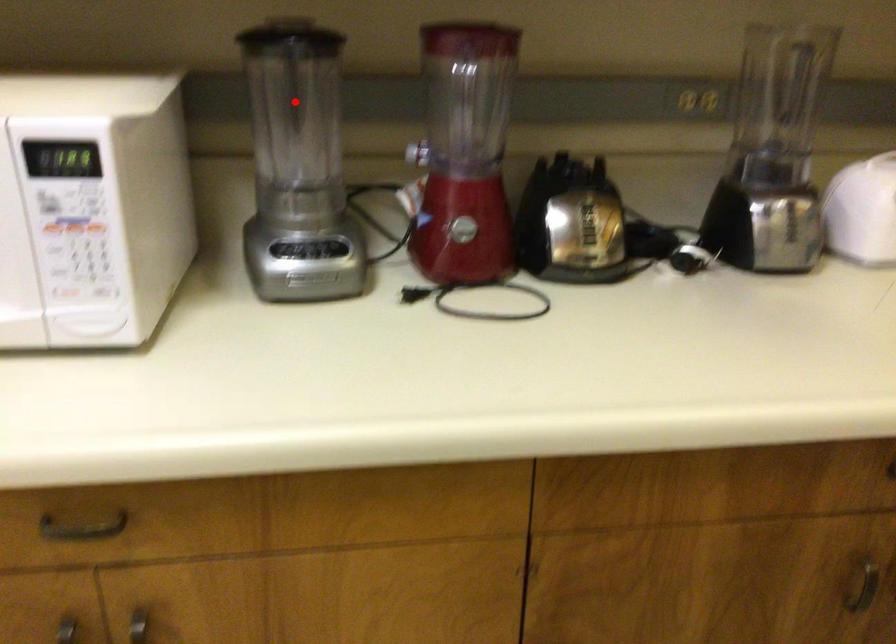
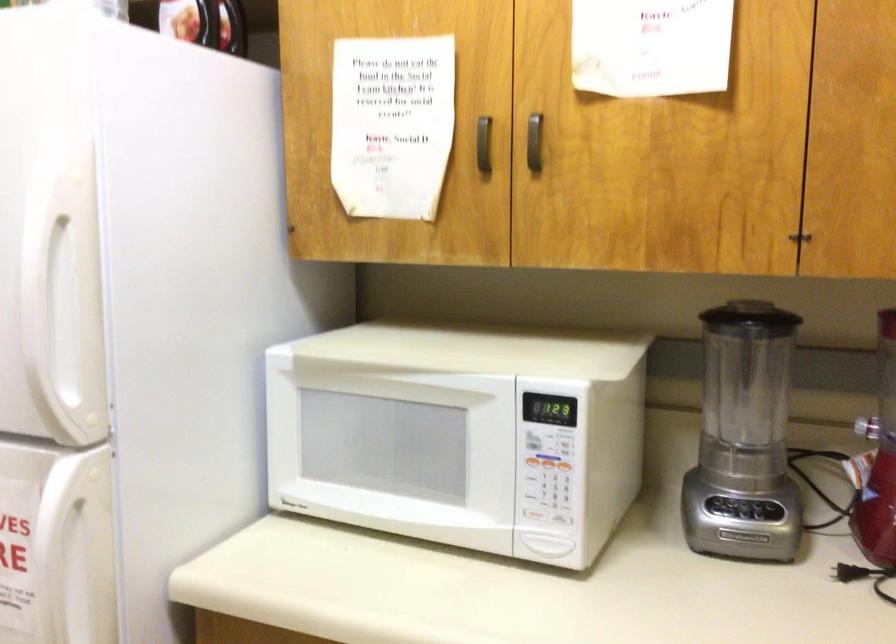
The point at the highlighted location is marked in the first image. Where is the corresponding point in the second image?

(746, 371)